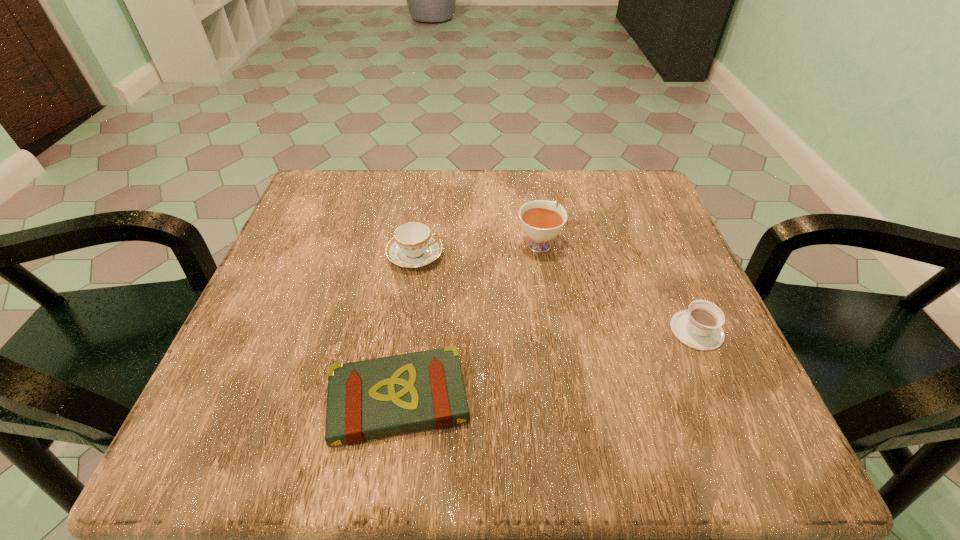
At what (x,y) coordinates should I click in order to perform the action: click on vacant region at the near edge of the desktop. Please return your answer as a coordinate pair (x, y). This screenshot has width=960, height=540. Looking at the image, I should click on (297, 461).

Locate an element on the screen. The height and width of the screenshot is (540, 960). blank space at the left edge is located at coordinates (321, 278).

Find the location of a particular element. The image size is (960, 540). vacant region at the right edge of the desktop is located at coordinates (661, 361).

Find the location of a particular element. blank area at the far left corner is located at coordinates (324, 181).

Identify the location of free space at the far right corner of the desktop. This screenshot has height=540, width=960. (609, 211).

You are a GUI agent. You are given a task and a screenshot of the screen. Output one action in this format:
    pyautogui.click(x=<x>, y=<y>)
    Task: Click on the free spot between the shortest object and the second tallest object
    The image size is (960, 540).
    Given the screenshot: What is the action you would take?
    pyautogui.click(x=407, y=327)

Identify the location of vacant area between the second tallest teacup and the nearest object. The image size is (960, 540). (407, 327).

Find the location of a particular element. Image resolution: width=960 pixels, height=540 pixels. free spot between the shortest teacup and the tallest teacup is located at coordinates (617, 287).

Locate an element on the screen. This screenshot has width=960, height=540. free space between the third farthest object and the leftmost teacup is located at coordinates click(556, 293).

You are a GUI agent. You are given a task and a screenshot of the screen. Output one action in this format:
    pyautogui.click(x=<x>, y=<y>)
    Task: Click on the free space between the second shortest object and the leftmost teacup
    The image size is (960, 540).
    Given the screenshot: What is the action you would take?
    pyautogui.click(x=556, y=293)